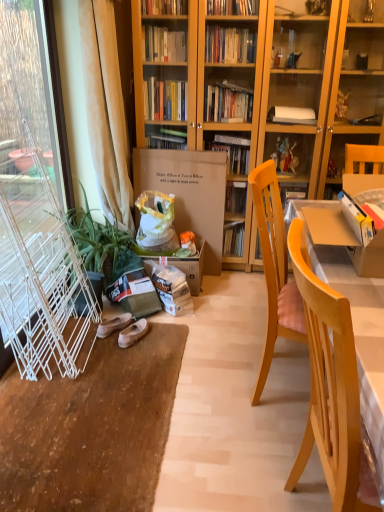
Question: From a real-world perspective, is white wire screen door at left physically above light wood chair at right?

Choices:
 (A) no
 (B) yes

Answer: (B)

Question: Can you confirm if white wire screen door at left is wider than light wood chair at right?

Choices:
 (A) no
 (B) yes

Answer: (A)

Question: Are white wire screen door at left and light wood chair at right located far from each other?

Choices:
 (A) no
 (B) yes

Answer: (B)

Question: Is white wire screen door at left facing away from light wood chair at right?

Choices:
 (A) yes
 (B) no

Answer: (B)

Question: Does white wire screen door at left have a lesser height compared to light wood chair at right?

Choices:
 (A) yes
 (B) no

Answer: (B)

Question: Choose the correct answer: Is light wood chair at right inside white fabric slipper at lower left, acting as the 1th footwear starting from the left, or outside it?

Choices:
 (A) inside
 (B) outside

Answer: (B)

Question: Does point (332, 449) appear closer or farther from the camera than point (105, 324)?

Choices:
 (A) closer
 (B) farther

Answer: (A)

Question: Visually, is light wood chair at right positioned to the left or to the right of white fabric slipper at lower left, acting as the 1th footwear starting from the left?

Choices:
 (A) right
 (B) left

Answer: (A)

Question: In the image, is light wood chair at right positioned in front of or behind white fabric slipper at lower left, the 2th footwear viewed from the right?

Choices:
 (A) behind
 (B) front

Answer: (B)

Question: Considering their positions, is white fabric slipper at lower left, acting as the 1th footwear starting from the left, located in front of or behind white wire screen door at left?

Choices:
 (A) front
 (B) behind

Answer: (B)

Question: Based on their positions, is white fabric slipper at lower left, the 2th footwear viewed from the right, located to the left or right of white wire screen door at left?

Choices:
 (A) right
 (B) left

Answer: (A)

Question: From the image's perspective, is white fabric slipper at lower left, acting as the 1th footwear starting from the left, above or below white wire screen door at left?

Choices:
 (A) above
 (B) below

Answer: (B)

Question: Is white fabric slipper at lower left, acting as the 1th footwear starting from the left, inside the boundaries of white wire screen door at left, or outside?

Choices:
 (A) outside
 (B) inside

Answer: (A)

Question: Considering the positions of point [x=36, y=246] and point [x=139, y=330], is point [x=36, y=246] closer or farther from the camera than point [x=139, y=330]?

Choices:
 (A) closer
 (B) farther

Answer: (A)

Question: Relative to white leather ballet flats at lower left, which is counted as the 1th footwear, starting from the right, is white wire screen door at left in front or behind?

Choices:
 (A) behind
 (B) front

Answer: (B)